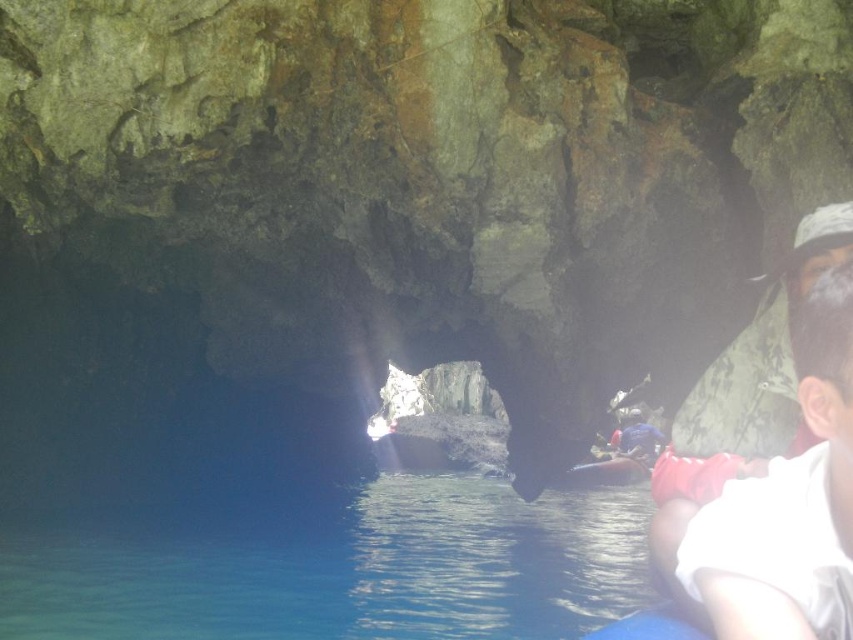
You are a hiker who wants to cross the cave to reach the sunlight at the far end. You have a white matte shirt at right and blue clear water at lower left in your path. Which object is on your left as you face the exit?

The blue clear water at lower left is positioned on the left side of white matte shirt at right, so as you face the exit, the blue clear water at lower left will be on your left side.

You are standing inside the cave and want to reach the exit seen at the far end. You notice the blue clear water at lower left and the white matte shirt at right. Which object is closer to you as you face the exit?

The blue clear water at lower left is closer to you because it is further to the viewer than the white matte shirt at right, meaning it is positioned nearer to your current location within the cave.